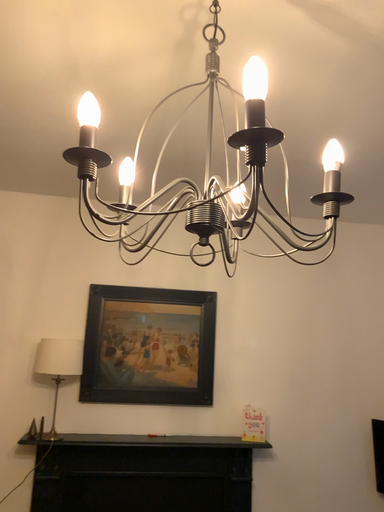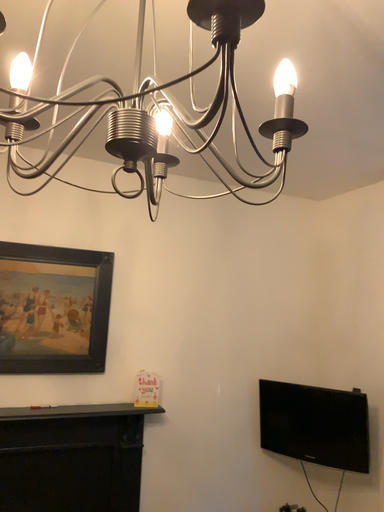
Question: How did the camera likely rotate when shooting the video?

Choices:
 (A) rotated left
 (B) rotated right

Answer: (B)